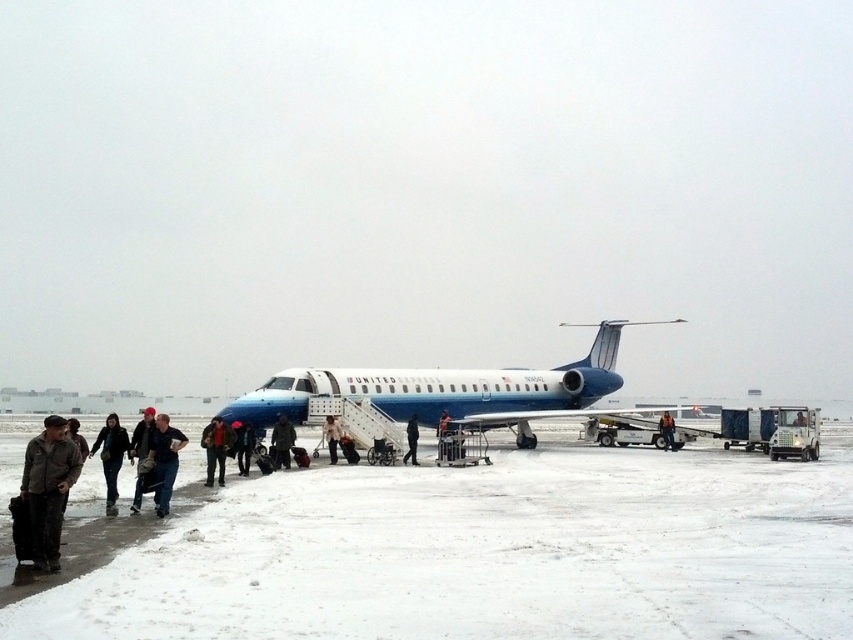
Question: Considering the real-world distances, which object is farthest from the black fabric jacket at center?

Choices:
 (A) dark blue jeans at lower center
 (B) white snow tarmac at lower left
 (C) dark brown leather jacket at lower left
 (D) dark blue jacket at center

Answer: (C)

Question: Is dark blue jacket at lower left positioned at the back of dark blue uniform at center?

Choices:
 (A) yes
 (B) no

Answer: (B)

Question: Is dark brown leather jacket at lower left bigger than dark blue uniform at center?

Choices:
 (A) yes
 (B) no

Answer: (A)

Question: Observing the image, what is the correct spatial positioning of black fabric jacket at center in reference to dark blue jeans at center?

Choices:
 (A) below
 (B) above

Answer: (B)

Question: Which object is positioned closest to the dark gray fabric jacket at lower left?

Choices:
 (A) dark blue jeans at lower center
 (B) dark brown leather jacket at lower left
 (C) white snow tarmac at lower left

Answer: (A)

Question: Among these points, which one is farthest from the camera?

Choices:
 (A) (276, 422)
 (B) (407, 426)

Answer: (B)